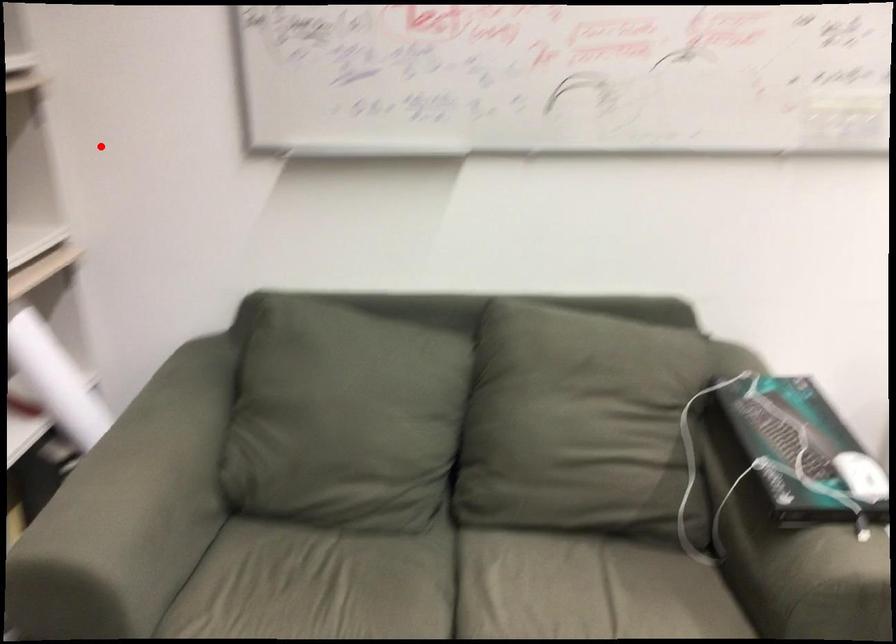
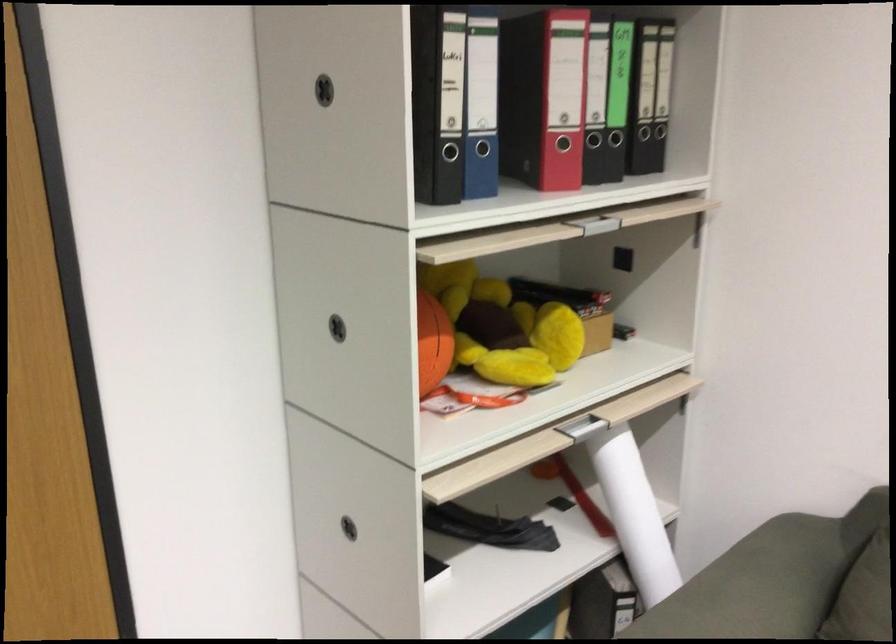
Question: I am providing you with two images of the same scene from different viewpoints. In image1, a red point is highlighted. Considering the same 3D point in image2, which of the following is correct?

Choices:
 (A) It is closer
 (B) It is farther

Answer: (A)